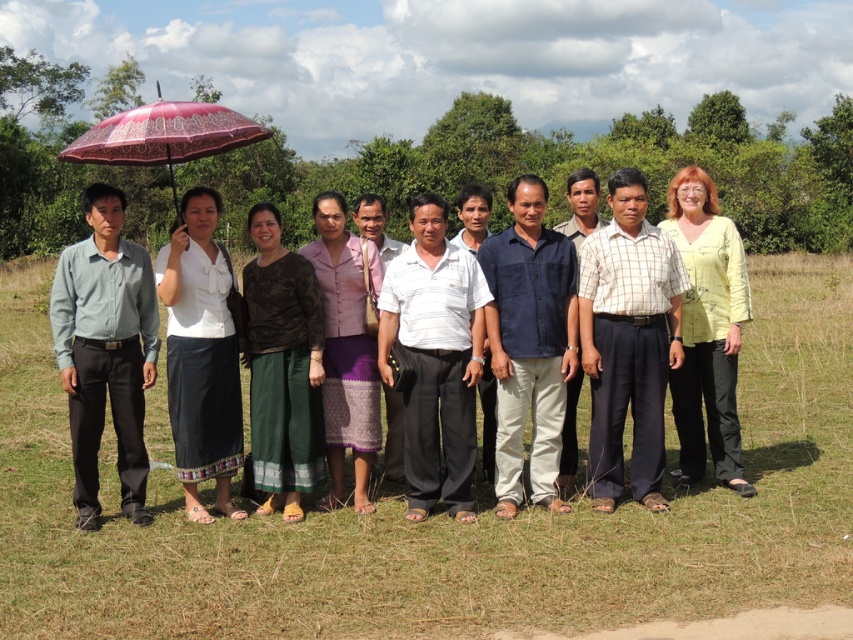
Can you confirm if solid white pants at center is positioned to the right of purple woven skirt at center?

Yes, solid white pants at center is to the right of purple woven skirt at center.

Between solid white pants at center and purple woven skirt at center, which one appears on the left side from the viewer's perspective?

Positioned to the left is purple woven skirt at center.

Is point (804, 268) in front of point (368, 500)?

That is False.

What are the coordinates of `solid white pants at center` in the screenshot? It's located at (439, 515).

Is solid white pants at center wider than pink lace umbrella at upper left?

Incorrect, solid white pants at center's width does not surpass pink lace umbrella at upper left's.

Is solid white pants at center below pink lace umbrella at upper left?

Yes, solid white pants at center is below pink lace umbrella at upper left.

Who is more distant from viewer, [331,612] or [175,138]?

Point [175,138]

Where is `solid white pants at center`? This screenshot has width=853, height=640. solid white pants at center is located at coordinates (439, 515).

Can you confirm if white woven skirt at center is bigger than pink lace umbrella at upper left?

No.

Which is more to the left, white woven skirt at center or pink lace umbrella at upper left?

pink lace umbrella at upper left

Locate an element on the screen. This screenshot has width=853, height=640. white woven skirt at center is located at coordinates (201, 355).

This screenshot has height=640, width=853. What are the coordinates of `white woven skirt at center` in the screenshot? It's located at (201, 355).